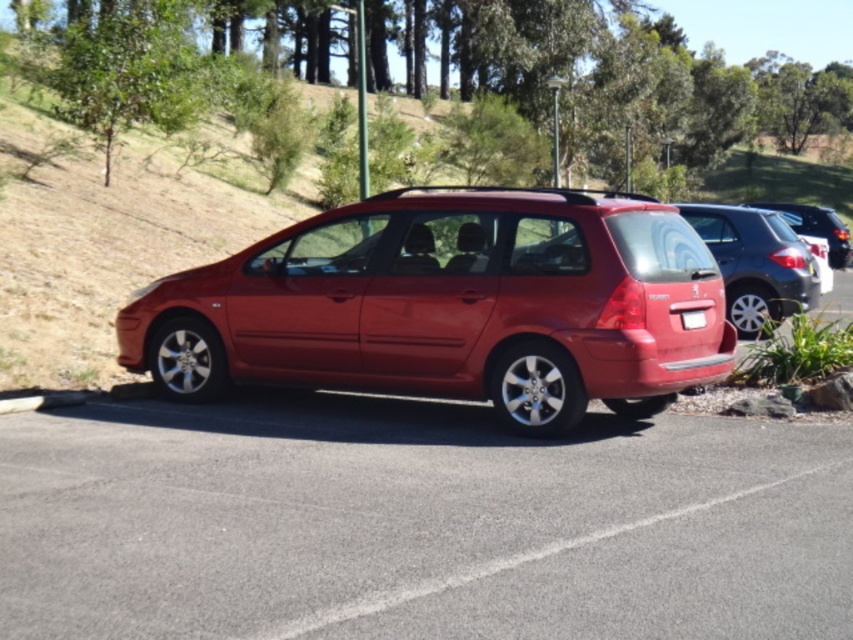
Question: Is glossy metallic car at center positioned in front of white plastic license plate at center?

Choices:
 (A) no
 (B) yes

Answer: (B)

Question: Which object is farther from the camera taking this photo?

Choices:
 (A) white plastic license plate at center
 (B) glossy asphalt parking lot at center
 (C) glossy metallic car at right

Answer: (C)

Question: Considering the real-world distances, which object is farthest from the glossy metallic minivan at right?

Choices:
 (A) glossy metallic car at right
 (B) glossy asphalt parking lot at center
 (C) glossy metallic car at center

Answer: (A)

Question: Is glossy asphalt parking lot at center to the left of glossy metallic minivan at right from the viewer's perspective?

Choices:
 (A) no
 (B) yes

Answer: (B)

Question: Which point is closer to the camera?

Choices:
 (A) glossy asphalt parking lot at center
 (B) glossy metallic car at center

Answer: (A)

Question: Does glossy asphalt parking lot at center have a smaller size compared to glossy metallic car at right?

Choices:
 (A) no
 (B) yes

Answer: (B)